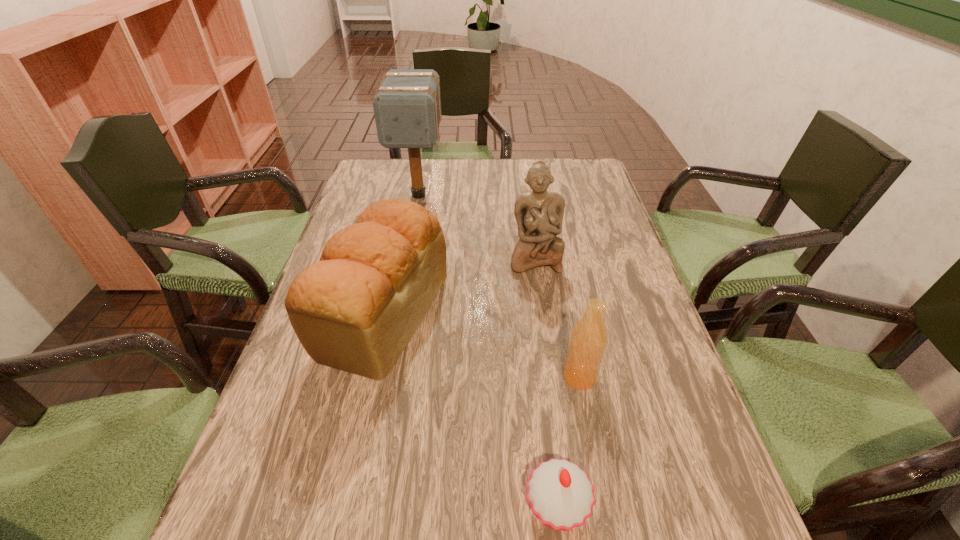
Where is `mallet that is at the left edge`? This screenshot has width=960, height=540. mallet that is at the left edge is located at coordinates (407, 106).

Find the location of a particular element. This screenshot has width=960, height=540. bread located at the left edge is located at coordinates (356, 309).

The height and width of the screenshot is (540, 960). Find the location of `object located at the far left corner`. object located at the far left corner is located at coordinates (407, 106).

Locate an element on the screen. This screenshot has width=960, height=540. blank space at the far edge of the desktop is located at coordinates (528, 166).

The height and width of the screenshot is (540, 960). What are the coordinates of `vacant space at the left edge of the desktop` in the screenshot? It's located at (219, 522).

Find the location of a particular element. This screenshot has height=540, width=960. vacant space at the right edge is located at coordinates (642, 423).

The width and height of the screenshot is (960, 540). In the image, there is a desktop. What are the coordinates of `free space at the far right corner` in the screenshot? It's located at (556, 181).

The height and width of the screenshot is (540, 960). Find the location of `unoccupied area between the bread and the beer bottle`. unoccupied area between the bread and the beer bottle is located at coordinates (481, 345).

This screenshot has height=540, width=960. I want to click on free space between the figurine and the bread, so click(459, 286).

At what (x,y) coordinates should I click in order to perform the action: click on free spot between the bread and the beer bottle. Please return your answer as a coordinate pair (x, y). Looking at the image, I should click on (481, 345).